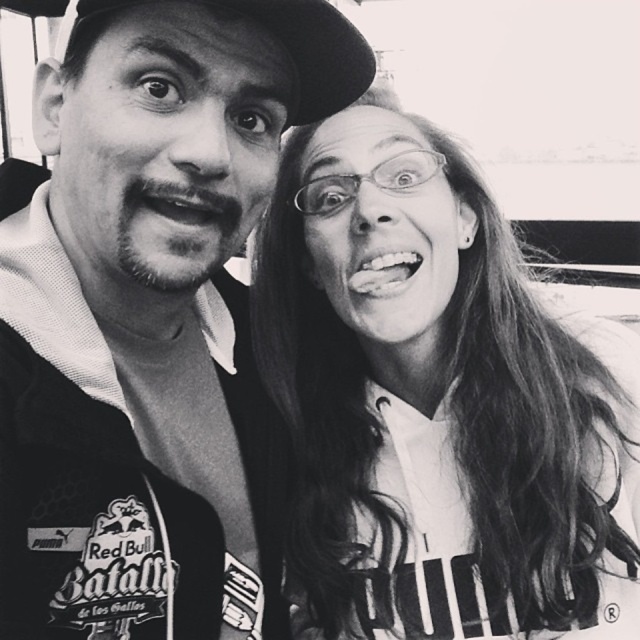
Is smooth leather jacket at center shorter than smooth white shirt at upper right?

No.

Who is taller, smooth leather jacket at center or smooth white shirt at upper right?

Standing taller between the two is smooth leather jacket at center.

Which is behind, point (196, 522) or point (406, 448)?

Point (406, 448)

Find the location of `smooth leather jacket at center`. smooth leather jacket at center is located at coordinates (148, 317).

Is smooth white shirt at upper right taller than black fabric baseball hat at upper center?

Correct, smooth white shirt at upper right is much taller as black fabric baseball hat at upper center.

Does smooth white shirt at upper right appear over black fabric baseball hat at upper center?

No.

Who is more forward, (x=369, y=548) or (x=305, y=108)?

Point (x=305, y=108)

Locate an element on the screen. The height and width of the screenshot is (640, 640). smooth white shirt at upper right is located at coordinates (436, 403).

Is smooth leather jacket at center positioned behind black fabric baseball hat at upper center?

That is False.

Between smooth leather jacket at center and black fabric baseball hat at upper center, which one appears on the left side from the viewer's perspective?

smooth leather jacket at center is more to the left.

Does point (228, 228) come closer to viewer compared to point (248, 4)?

That is False.

The height and width of the screenshot is (640, 640). Identify the location of smooth leather jacket at center. (148, 317).